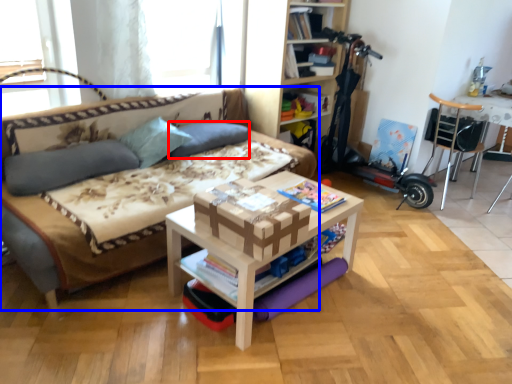
Question: Which point is further to the camera, pillow (highlighted by a red box) or studio couch (highlighted by a blue box)?

Choices:
 (A) pillow
 (B) studio couch

Answer: (A)